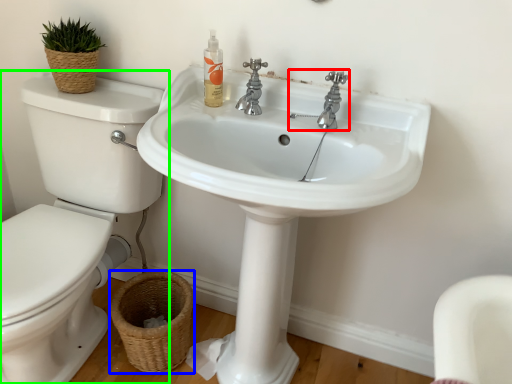
Question: Which object is the farthest from tap (highlighted by a red box)? Choose among these: basket (highlighted by a blue box) or toilet (highlighted by a green box).

Choices:
 (A) basket
 (B) toilet

Answer: (A)